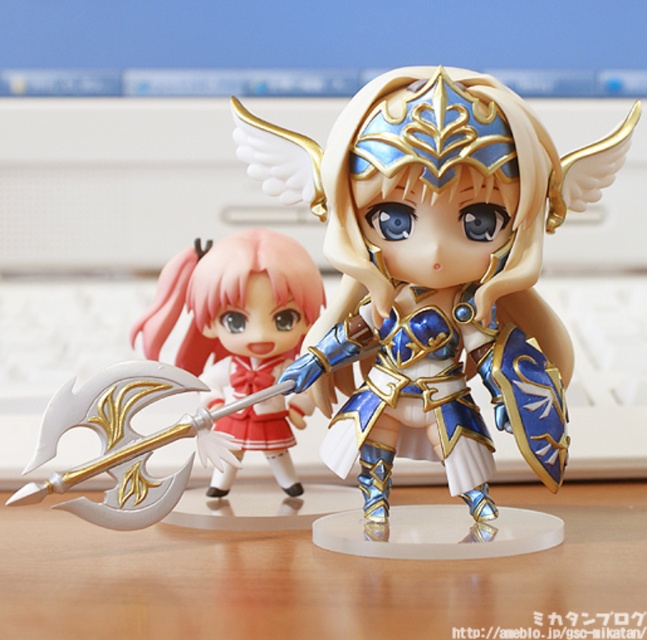
Which is below, blue metallic armor at center or wooden table at center?

wooden table at center is lower down.

Identify the location of blue metallic armor at center. The height and width of the screenshot is (640, 647). (435, 269).

Where is `blue metallic armor at center`? blue metallic armor at center is located at coordinates (435, 269).

Is the position of blue metallic armor at center more distant than that of matte gold axe at center?

No, it is in front of matte gold axe at center.

Based on the photo, does blue metallic armor at center lie in front of matte gold axe at center?

Yes, blue metallic armor at center is in front of matte gold axe at center.

This screenshot has width=647, height=640. I want to click on blue metallic armor at center, so click(x=435, y=269).

Who is more forward, (338, 570) or (285, 445)?

Positioned in front is point (338, 570).

Between point (12, 544) and point (228, 300), which one is positioned behind?

The point (228, 300) is behind.

Identify the location of wooden table at center. (322, 579).

At what (x,y) coordinates should I click in order to perform the action: click on wooden table at center. Please return your answer as a coordinate pair (x, y). Looking at the image, I should click on (322, 579).